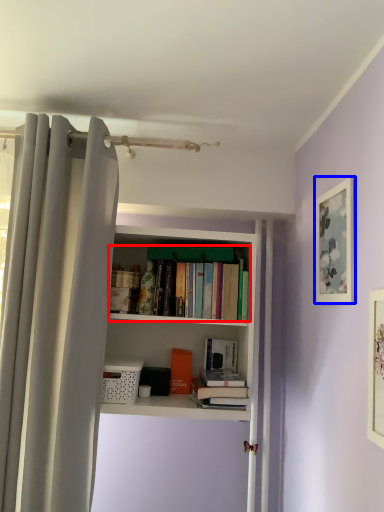
Question: Which object is closer to the camera taking this photo, book (highlighted by a red box) or picture frame (highlighted by a blue box)?

Choices:
 (A) book
 (B) picture frame

Answer: (B)